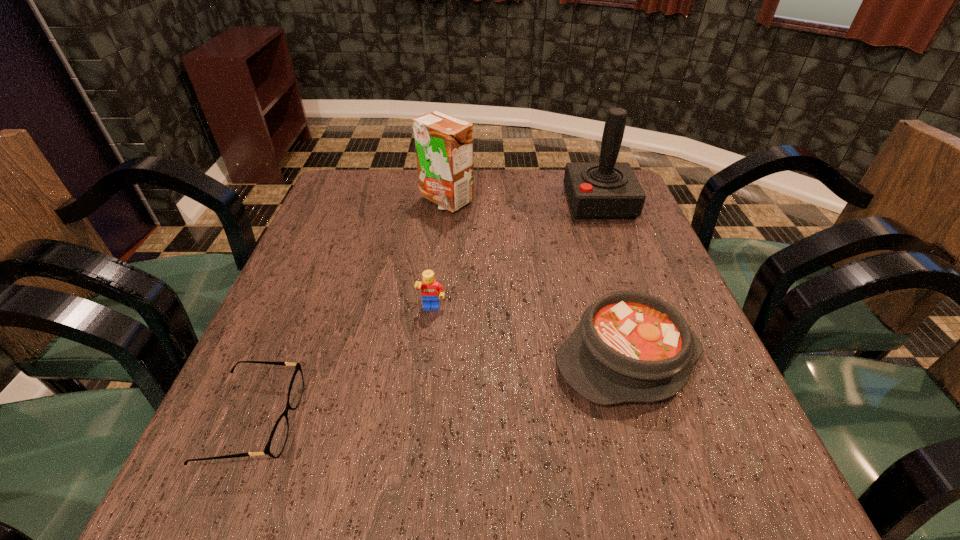
In order to click on free region located 0.230m on the face of the Lego in this screenshot , I will do `click(420, 420)`.

Locate an element on the screen. Image resolution: width=960 pixels, height=540 pixels. free spot located 0.050m on the left of the casserole is located at coordinates (x=526, y=359).

I want to click on free location located 0.340m on the front-facing side of the spectacles, so [501, 421].

Locate an element on the screen. joystick present at the far edge is located at coordinates (607, 189).

The image size is (960, 540). I want to click on carton located in the far edge section of the desktop, so click(x=444, y=144).

Locate an element on the screen. object located at the near edge is located at coordinates (277, 440).

The image size is (960, 540). Identify the location of object that is at the left edge. (277, 440).

Find the location of a particular element. joystick that is positioned at the right edge is located at coordinates (607, 189).

You are a GUI agent. You are given a task and a screenshot of the screen. Output one action in this format:
    pyautogui.click(x=<x>, y=<y>)
    Task: Click on the casserole at the right edge
    The image size is (960, 540).
    Given the screenshot: What is the action you would take?
    pyautogui.click(x=629, y=346)

At what (x,y) coordinates should I click in order to perform the action: click on object that is at the near left corner. Please return your answer as a coordinate pair (x, y). The image size is (960, 540). Looking at the image, I should click on (277, 440).